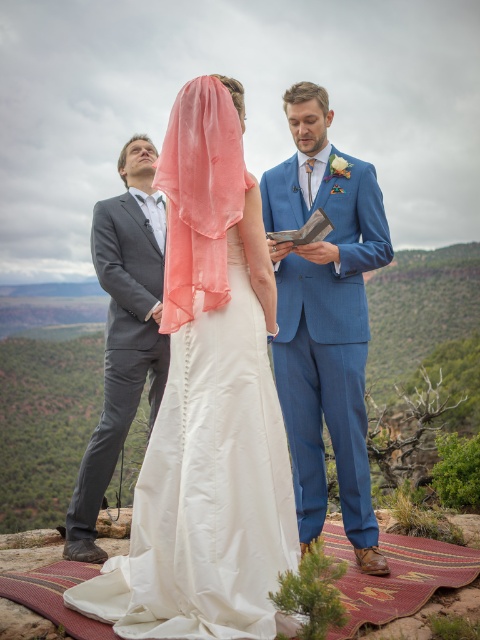
You are a photographer at the wedding ceremony. You need to position yourself so that you can capture the white satin dress at center in the frame. Given that the camera has a field of view of 60 degrees, can you estimate if the point at coordinates (207, 488) will be within the camera frame?

The point at coordinates (207, 488) corresponds to the white satin dress at center, which is within the camera frame since the camera has a 60 degree field of view and the dress is centrally located.

You are a photographer at the wedding ceremony. You need to position yourself so that both the blue wool suit at center and the coral sheer veil at center are in the frame. Given that your camera has a maximum focus range of 3 feet, will you be able to capture both objects clearly in the same photo?

The distance between the blue wool suit at center and the coral sheer veil at center is 3.39 feet. Since the camera can only focus within 3 feet, the objects are slightly out of the focus range. Therefore, you won